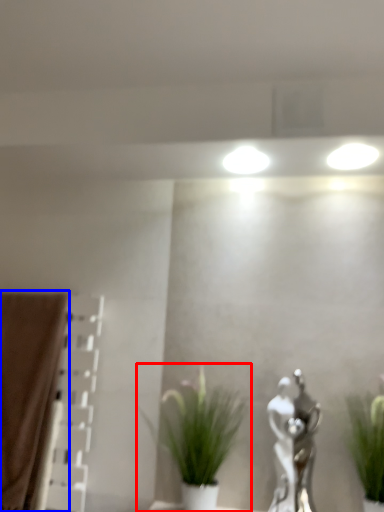
Question: Which object is further to the camera taking this photo, houseplant (highlighted by a red box) or curtain (highlighted by a blue box)?

Choices:
 (A) houseplant
 (B) curtain

Answer: (B)